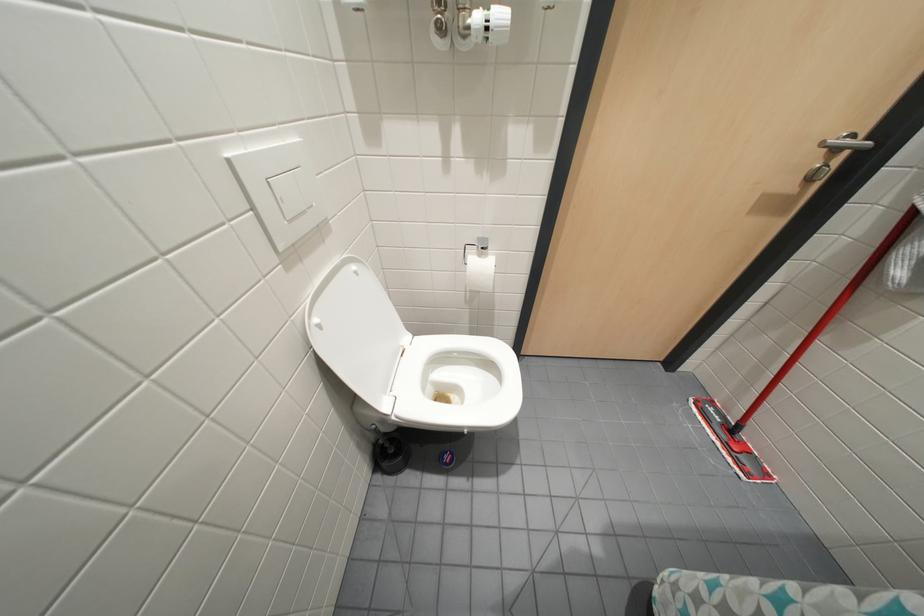
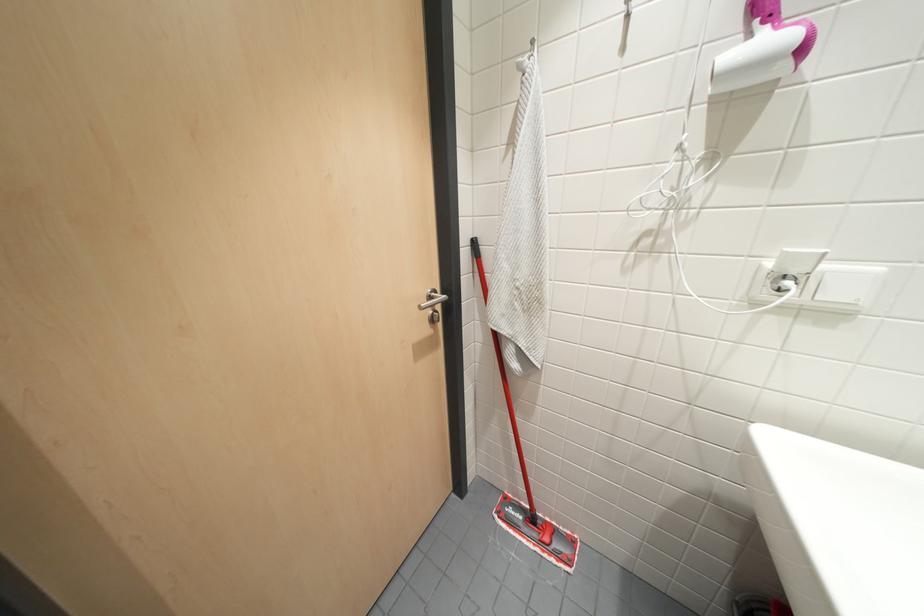
Question: The first image is from the beginning of the video and the second image is from the end. How did the camera likely rotate when shooting the video?

Choices:
 (A) Left
 (B) Right
 (C) Up
 (D) Down

Answer: (B)